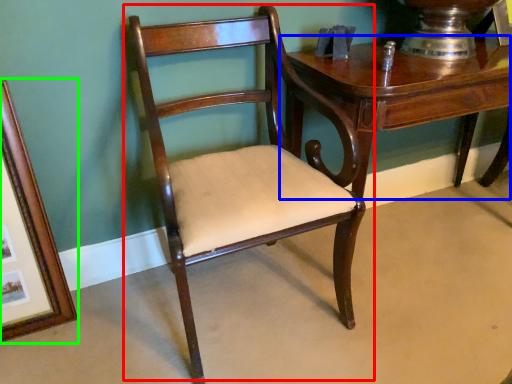
Question: Which object is positioned closest to chair (highlighted by a red box)? Select from table (highlighted by a blue box) and picture frame (highlighted by a green box).

Choices:
 (A) table
 (B) picture frame

Answer: (A)